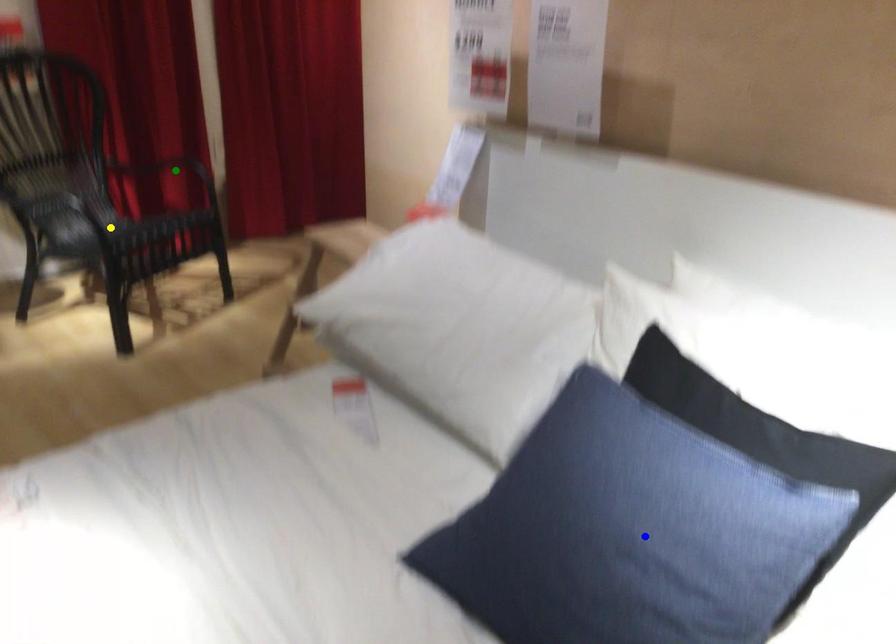
Order these from nearest to farthest:
- blue point
- green point
- yellow point

blue point < yellow point < green point